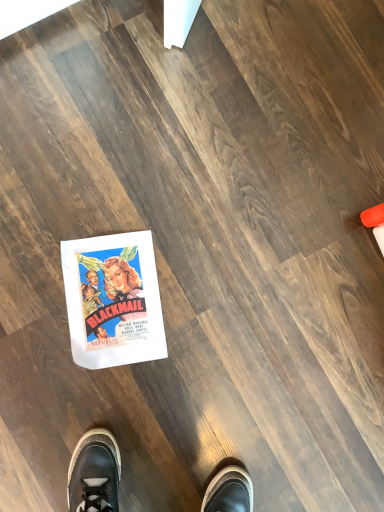
Image resolution: width=384 pixels, height=512 pixels. Identify the location of vacant region to the left of white paper at center. (55, 219).